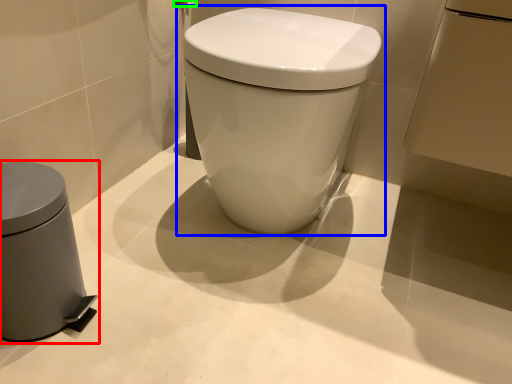
Question: Based on their relative distances, which object is farther from waste container (highlighted by a red box)? Choose from toilet (highlighted by a blue box) and towel bar (highlighted by a green box).

Choices:
 (A) toilet
 (B) towel bar

Answer: (B)